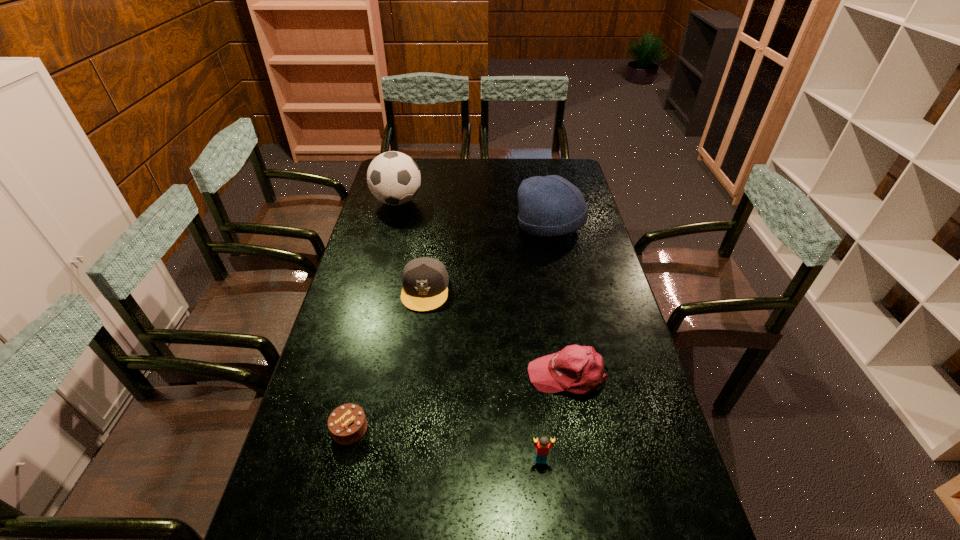
This screenshot has height=540, width=960. In the image, there is a desktop. In order to click on vacant space at the left edge in this screenshot , I will do `click(366, 256)`.

Where is `free spot at the right edge of the desktop`? free spot at the right edge of the desktop is located at coordinates (602, 272).

This screenshot has height=540, width=960. Identify the location of vacant area that lies between the third farthest object and the chocolate cake. (388, 359).

Find the location of a particular element. The width and height of the screenshot is (960, 540). vacant space in between the third farthest object and the chocolate cake is located at coordinates (388, 359).

This screenshot has height=540, width=960. I want to click on free space between the chocolate cake and the baseball cap, so click(x=459, y=402).

Where is `free space between the baseball cap and the skullcap`? The height and width of the screenshot is (540, 960). free space between the baseball cap and the skullcap is located at coordinates (560, 301).

Find the location of a particular element. This screenshot has height=540, width=960. free space between the soccer ball and the baseball cap is located at coordinates (483, 288).

Identify the location of empty location between the soccer ball and the fourth nearest object. 411,246.

At what (x,y) coordinates should I click in order to perform the action: click on vacant area between the cap and the soccer ball. Please return your answer as a coordinate pair (x, y). This screenshot has width=960, height=540. Looking at the image, I should click on (411, 246).

Where is `free spot between the nearest object and the skullcap`? This screenshot has height=540, width=960. free spot between the nearest object and the skullcap is located at coordinates (545, 343).